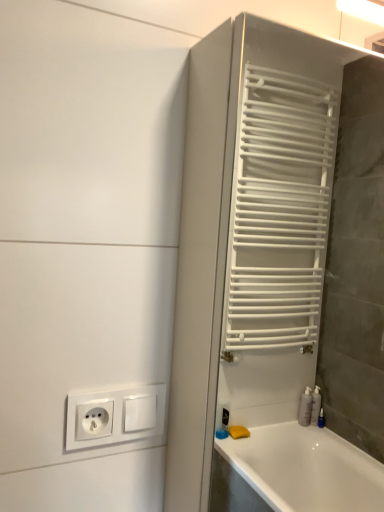
Question: Is white plastic socket at lower left outside white matte towel rack at right?

Choices:
 (A) yes
 (B) no

Answer: (A)

Question: Is white matte towel rack at right inside white plastic socket at lower left?

Choices:
 (A) no
 (B) yes

Answer: (A)

Question: Can you confirm if white plastic socket at lower left is positioned to the right of white matte towel rack at right?

Choices:
 (A) no
 (B) yes

Answer: (A)

Question: Does white plastic socket at lower left have a lesser width compared to white matte towel rack at right?

Choices:
 (A) yes
 (B) no

Answer: (A)

Question: Is white plastic socket at lower left bigger than white matte towel rack at right?

Choices:
 (A) yes
 (B) no

Answer: (B)

Question: Is white plastic socket at lower left not close to white matte towel rack at right?

Choices:
 (A) yes
 (B) no

Answer: (A)

Question: Does white matte towel rack at right have a greater height compared to white plastic socket at lower left?

Choices:
 (A) yes
 (B) no

Answer: (A)

Question: From the image's perspective, is white matte towel rack at right below white plastic socket at lower left?

Choices:
 (A) yes
 (B) no

Answer: (B)

Question: Is white matte towel rack at right wider than white plastic socket at lower left?

Choices:
 (A) yes
 (B) no

Answer: (A)

Question: Is white matte towel rack at right positioned before white plastic socket at lower left?

Choices:
 (A) no
 (B) yes

Answer: (B)

Question: Is white matte towel rack at right next to white plastic socket at lower left?

Choices:
 (A) yes
 (B) no

Answer: (B)

Question: Is white matte towel rack at right smaller than white plastic socket at lower left?

Choices:
 (A) yes
 (B) no

Answer: (B)

Question: Would you say white matte towel rack at right is inside or outside white plastic socket at lower left?

Choices:
 (A) outside
 (B) inside

Answer: (A)